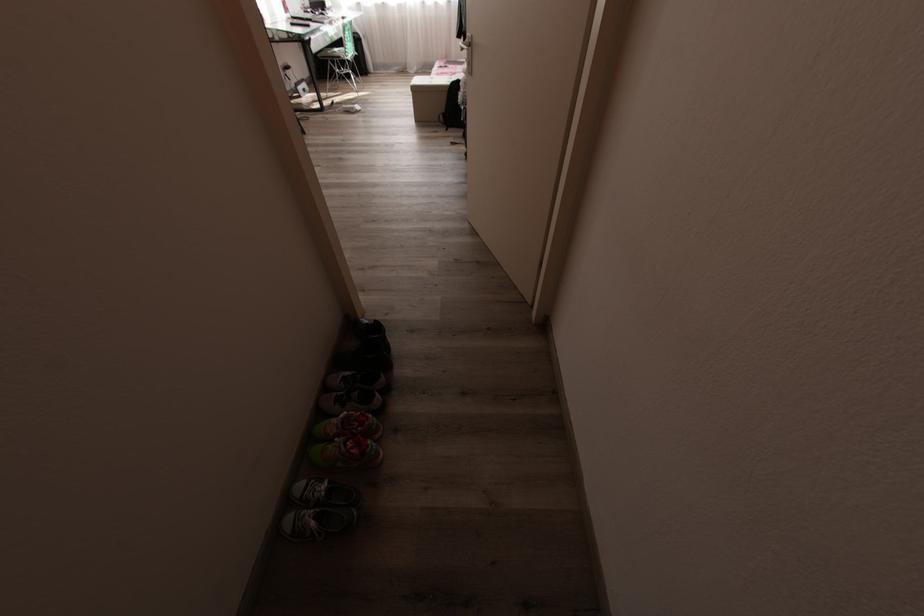
Image resolution: width=924 pixels, height=616 pixels. I want to click on green chair sitting surface, so click(x=332, y=52).